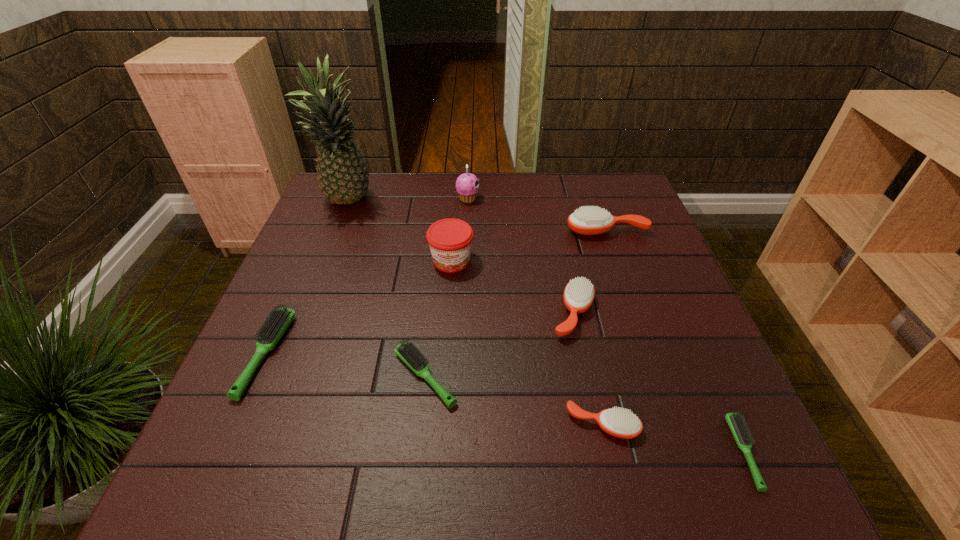
Select which orange hairbrush appears as the second closest to the farthest orange hairbrush. Please provide its 2D coordinates. Your answer should be formatted as a tuple, i.e. [(x, y)], where the tuple contains the x and y coordinates of a point satisfying the conditions above.

[(617, 422)]

The width and height of the screenshot is (960, 540). Identify the location of the third closest orange hairbrush to the shortest object. (593, 220).

Locate which light hairbrush ranks second in proximity to the sixth nearest object. Please provide its 2D coordinates. Your answer should be formatted as a tuple, i.e. [(x, y)], where the tuple contains the x and y coordinates of a point satisfying the conditions above.

[(276, 324)]

This screenshot has height=540, width=960. Identify the location of the second closest light hairbrush to the second light hairbrush from right to left. (735, 421).

This screenshot has height=540, width=960. I want to click on free space that satisfies the following two spatial constraints: 1. on the label side of the fourth farthest object; 2. on the left side of the nearest light hairbrush, so click(438, 451).

I want to click on free space that satisfies the following two spatial constraints: 1. on the back side of the second hairbrush from left to right; 2. on the left side of the second tallest hairbrush, so click(x=432, y=313).

Find the location of a particular element. This screenshot has height=540, width=960. vacant area in the image that satisfies the following two spatial constraints: 1. on the front side of the smallest orange hairbrush; 2. on the left side of the leftmost hairbrush is located at coordinates (236, 424).

Find the location of a particular element. vacant space that satisfies the following two spatial constraints: 1. on the face of the nearest orange hairbrush; 2. on the left side of the cupcake is located at coordinates (460, 424).

You are a GUI agent. You are given a task and a screenshot of the screen. Output one action in this format:
    pyautogui.click(x=<x>, y=<y>)
    Task: Click on the vacant region that satisfies the following two spatial constraints: 1. on the face of the second tallest object; 2. on the left side of the smallest orange hairbrush
    
    Given the screenshot: What is the action you would take?
    pyautogui.click(x=460, y=424)

The width and height of the screenshot is (960, 540). I want to click on vacant region that satisfies the following two spatial constraints: 1. on the face of the cupcake; 2. on the right side of the nearest orange hairbrush, so click(460, 424).